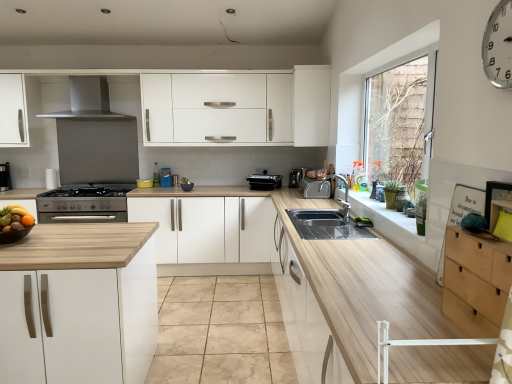
Locate an element on the screen. The image size is (512, 384). vacant space situated on the left part of satin silver toaster at center is located at coordinates (285, 196).